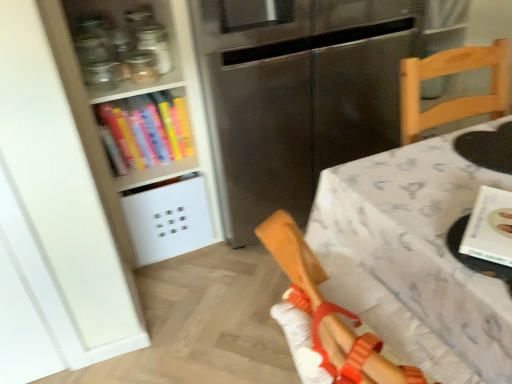
Identify the location of free point to the left of white paper book at right, positioned as the 1th book in front-to-back order. The height and width of the screenshot is (384, 512). click(x=428, y=235).